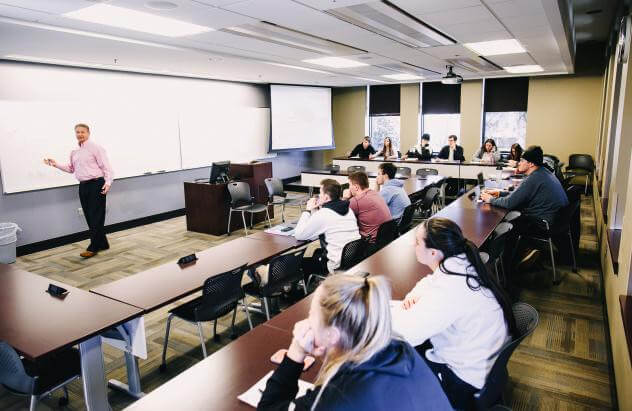
Where is `ceiling lights`? The width and height of the screenshot is (632, 411). ceiling lights is located at coordinates (143, 15), (339, 67), (408, 75), (489, 45), (523, 73).